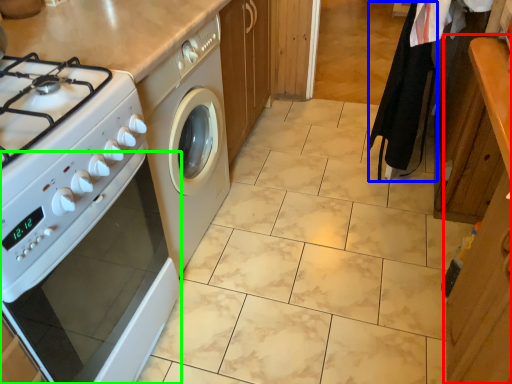
Question: Which object is positioned farthest from cabinetry (highlighted by a red box)? Select from robe (highlighted by a blue box) and oven (highlighted by a green box).

Choices:
 (A) robe
 (B) oven

Answer: (B)